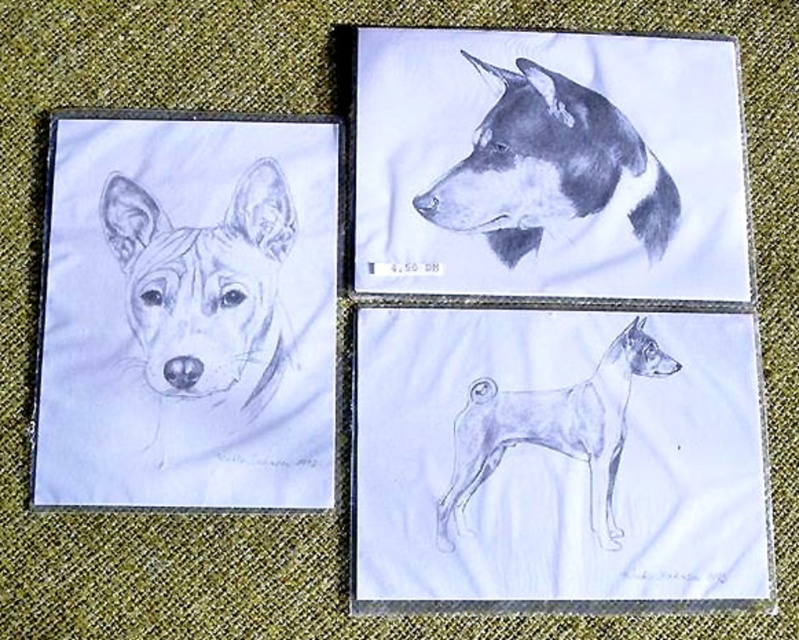
Question: Which object is the farthest from the graphite sketch dog at center?

Choices:
 (A) graphite sketch dog at upper center
 (B) graphite sketch of dog at upper left

Answer: (B)

Question: Does graphite sketch dog at upper center appear over graphite sketch dog at center?

Choices:
 (A) no
 (B) yes

Answer: (B)

Question: Which object appears closest to the camera in this image?

Choices:
 (A) graphite sketch dog at center
 (B) graphite sketch dog at upper center

Answer: (A)

Question: Which point is closer to the camera?

Choices:
 (A) click(451, 497)
 (B) click(161, 253)
 (C) click(543, 195)

Answer: (A)

Question: Can you confirm if graphite sketch of dog at upper left is positioned above graphite sketch dog at center?

Choices:
 (A) yes
 (B) no

Answer: (A)

Question: Is graphite sketch dog at upper center smaller than graphite sketch dog at center?

Choices:
 (A) yes
 (B) no

Answer: (B)